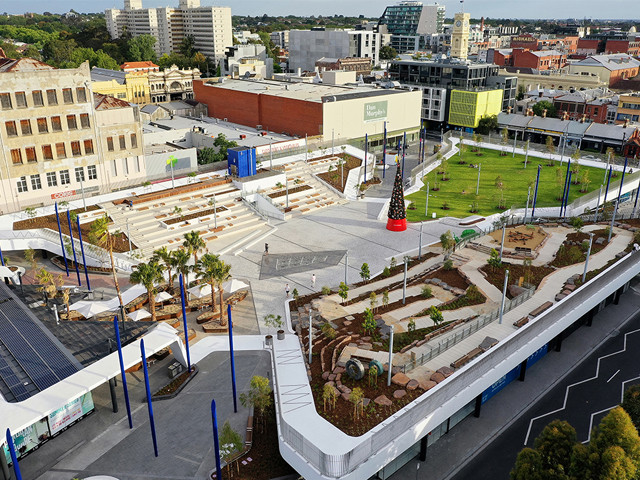
This screenshot has height=480, width=640. I want to click on christmas tree, so click(396, 204).